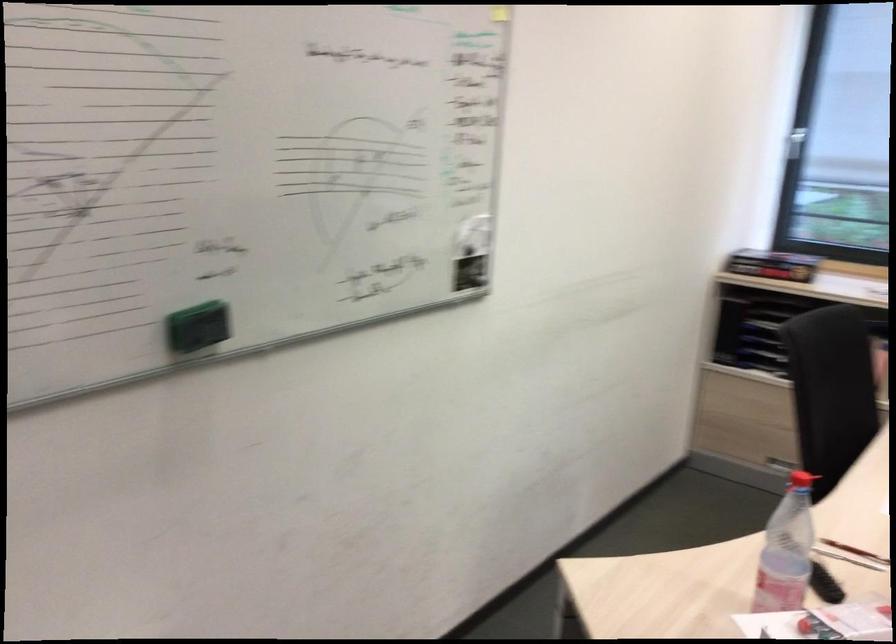
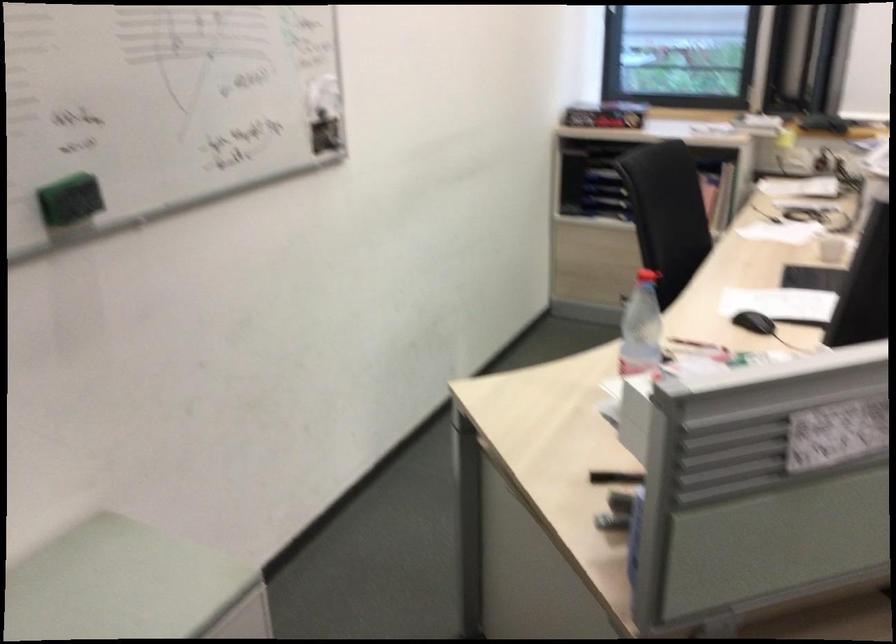
In the second image, find the point that corresponds to the point at 794,540 in the first image.

(641, 327)